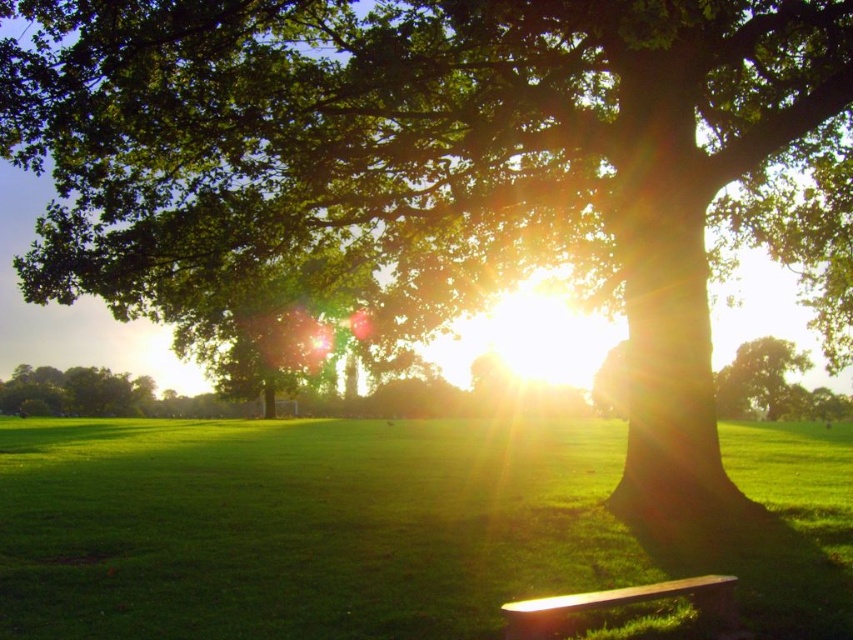
You are planning to place a new bench in your garden. You have a black matte bench at lower center and a green leafy tree at center. Which object is wider?

The green leafy tree at center is wider than the black matte bench at lower center.

You are a gardener planning to plant a new flower bed. You have two areas to choose from in the scene shown. One is the green grassy at lower center and the other is the green leafy tree at center. Which area would you choose for the flower bed and why?

The green grassy at lower center has a larger size compared to the green leafy tree at center, making it a better choice for planting a flower bed as there is more space available.